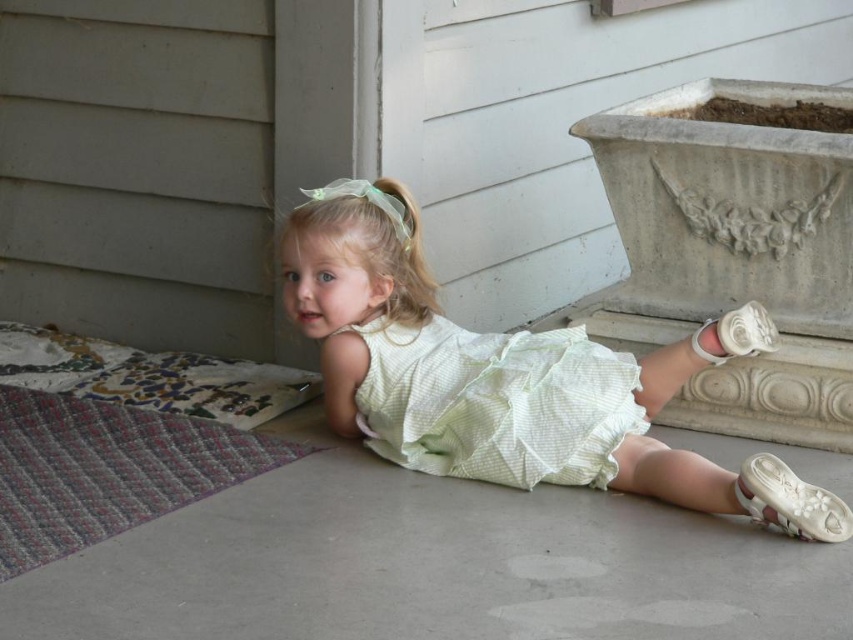
You are standing at the position of the child in the image. Looking down, you see a point marked at coordinates (430, 564). What surface does this point indicate you are touching with your hand?

The point at (430, 564) corresponds to the white smooth cement at lower center, so you are touching the white smooth cement at lower center with your hand.

You are a photographer trying to capture the child in the image. Since you want to focus on the main outfit, which object should you zoom in on more closely between the light green textured dress at center and the white satin shoe at lower right?

The light green textured dress at center is bigger than the white satin shoe at lower right, so you should zoom in on the light green textured dress at center to focus on the main outfit.

You are a delivery person trying to place a small package on the surface. The package is 2 inches tall. You have two options in the image to place it on the white smooth cement at lower center or the white satin shoe at lower right. Which surface can the package be placed on without it being taller than the surface?

The white smooth cement at lower center has a greater height compared to the white satin shoe at lower right. Therefore, the package can be placed on the white smooth cement at lower center since it is taller than the package.